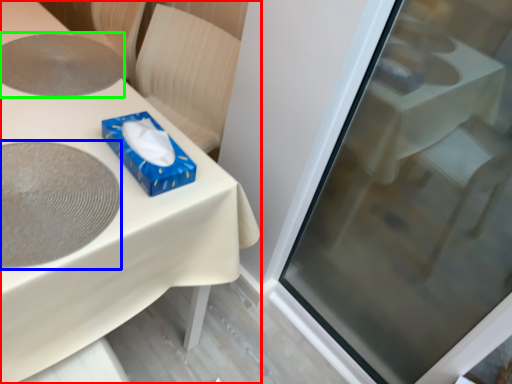
Question: Which object is the farthest from table (highlighted by a red box)? Choose among these: oval (highlighted by a blue box) or oval (highlighted by a green box).

Choices:
 (A) oval
 (B) oval

Answer: (B)